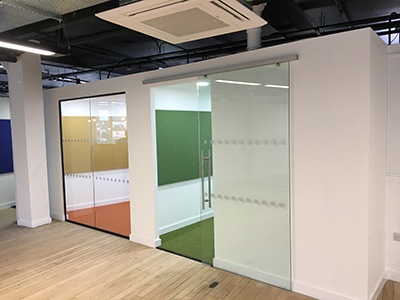
Where is `carpet`? carpet is located at coordinates (112, 218).